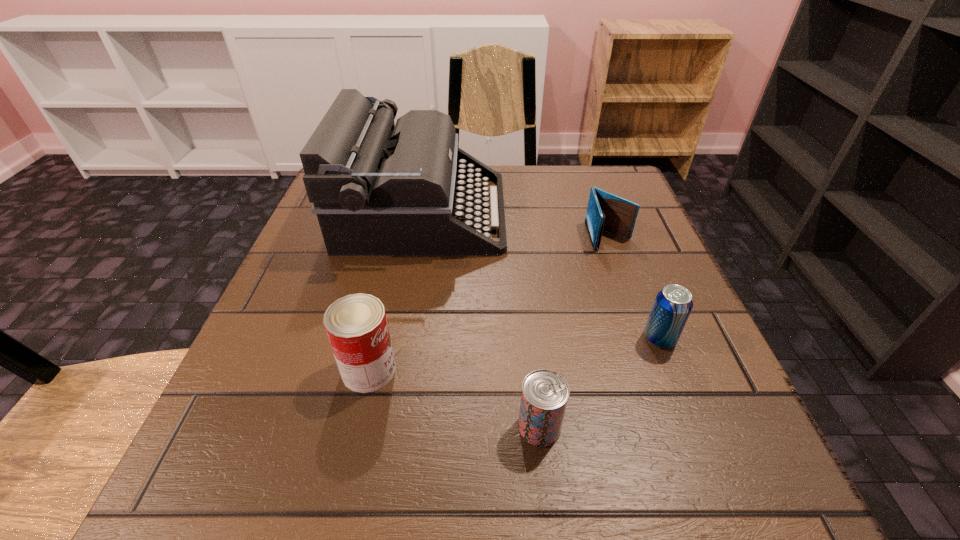
Locate an element on the screen. vacant area at the left edge of the desktop is located at coordinates (274, 384).

Where is `free space at the right edge`? The width and height of the screenshot is (960, 540). free space at the right edge is located at coordinates (643, 332).

In the image, there is a desktop. At what (x,y) coordinates should I click in order to perform the action: click on blank space at the near left corner. Please return your answer as a coordinate pair (x, y). Looking at the image, I should click on (208, 507).

Find the location of a particular element. This screenshot has height=540, width=960. vacant space at the far right corner is located at coordinates (594, 166).

The height and width of the screenshot is (540, 960). In order to click on free space at the near right corner of the desktop in this screenshot , I will do `click(786, 510)`.

Locate an element on the screen. This screenshot has width=960, height=540. vacant space that's between the can and the wallet is located at coordinates (489, 303).

Locate an element on the screen. The height and width of the screenshot is (540, 960). free space between the tallest object and the wallet is located at coordinates (516, 224).

The image size is (960, 540). Identify the location of blank region between the nearest object and the tallest object. (481, 320).

This screenshot has width=960, height=540. Find the location of `empty location between the left beer can and the farther beer can`. empty location between the left beer can and the farther beer can is located at coordinates (599, 383).

At what (x,y) coordinates should I click in order to perform the action: click on free space between the wallet and the can. Please return your answer as a coordinate pair (x, y). Looking at the image, I should click on (489, 303).